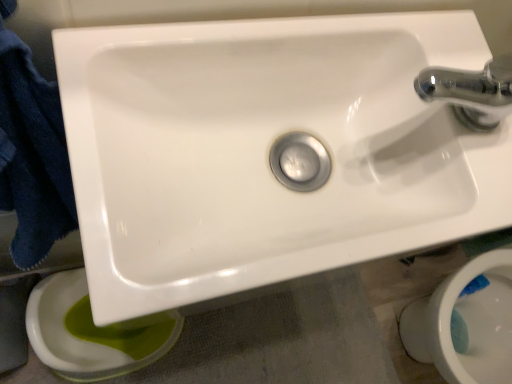
Question: Is dark blue towel at left smaller than white glossy toilet bowl at lower right, which is the first toilet bowl from right to left?

Choices:
 (A) yes
 (B) no

Answer: (A)

Question: Is dark blue towel at left further to camera compared to white glossy toilet bowl at lower right, the second toilet bowl positioned from the left?

Choices:
 (A) yes
 (B) no

Answer: (B)

Question: From a real-world perspective, is dark blue towel at left under white glossy toilet bowl at lower right, the second toilet bowl positioned from the left?

Choices:
 (A) no
 (B) yes

Answer: (A)

Question: Is dark blue towel at left turned away from white glossy toilet bowl at lower right, which is the first toilet bowl from right to left?

Choices:
 (A) yes
 (B) no

Answer: (B)

Question: From the image's perspective, does dark blue towel at left appear higher than white glossy toilet bowl at lower right, the second toilet bowl positioned from the left?

Choices:
 (A) no
 (B) yes

Answer: (B)

Question: Looking at the image, does white glossy sink at center seem bigger or smaller compared to dark blue towel at left?

Choices:
 (A) small
 (B) big

Answer: (B)

Question: From a real-world perspective, is white glossy sink at center above or below dark blue towel at left?

Choices:
 (A) below
 (B) above

Answer: (B)

Question: Is point (248, 233) positioned closer to the camera than point (19, 87)?

Choices:
 (A) farther
 (B) closer

Answer: (A)

Question: Is white glossy sink at center wider or thinner than dark blue towel at left?

Choices:
 (A) thin
 (B) wide

Answer: (B)

Question: Is green glossy toilet bowl at lower left, the 1th toilet bowl viewed from the left, in front of or behind white glossy sink at center in the image?

Choices:
 (A) behind
 (B) front

Answer: (A)

Question: Would you say green glossy toilet bowl at lower left, the 1th toilet bowl viewed from the left, is to the left or to the right of white glossy sink at center in the picture?

Choices:
 (A) right
 (B) left

Answer: (B)

Question: Looking at their shapes, would you say green glossy toilet bowl at lower left, arranged as the second toilet bowl when viewed from the right, is wider or thinner than white glossy sink at center?

Choices:
 (A) wide
 (B) thin

Answer: (A)

Question: From a real-world perspective, relative to white glossy sink at center, is green glossy toilet bowl at lower left, the 1th toilet bowl viewed from the left, vertically above or below?

Choices:
 (A) below
 (B) above

Answer: (A)

Question: Would you say white glossy sink at center is inside or outside white glossy toilet bowl at lower right, the second toilet bowl positioned from the left?

Choices:
 (A) inside
 (B) outside

Answer: (B)

Question: Is white glossy sink at center bigger or smaller than white glossy toilet bowl at lower right, the second toilet bowl positioned from the left?

Choices:
 (A) big
 (B) small

Answer: (B)